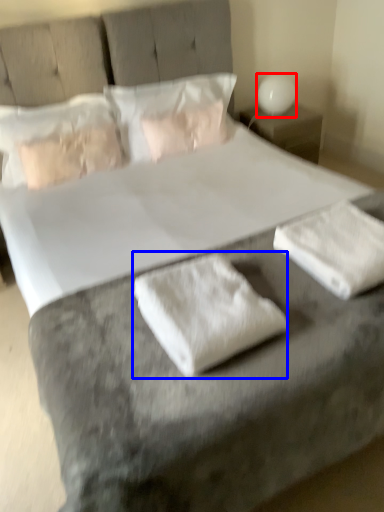
Question: Which point is closer to the camera, table lamp (highlighted by a red box) or material (highlighted by a blue box)?

Choices:
 (A) table lamp
 (B) material

Answer: (B)